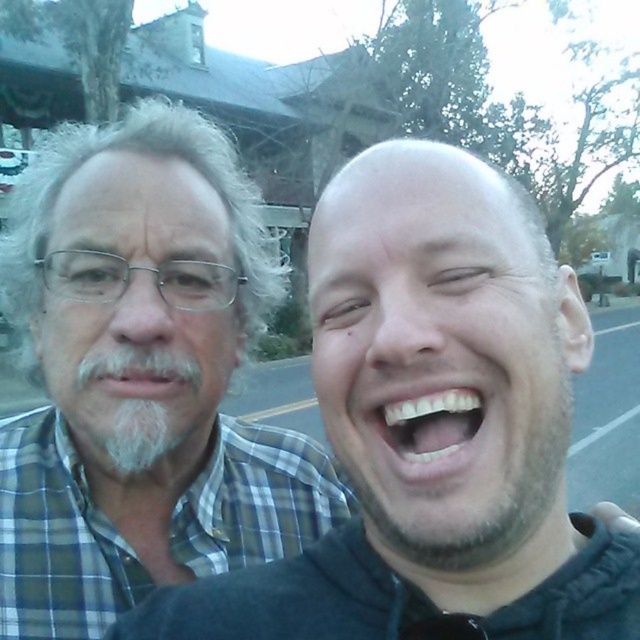
Question: Can you confirm if black matte jacket at center is positioned below gray plaid shirt at left?

Choices:
 (A) yes
 (B) no

Answer: (A)

Question: Is black matte jacket at center wider than gray plaid shirt at left?

Choices:
 (A) yes
 (B) no

Answer: (A)

Question: Which point is farther to the camera?

Choices:
 (A) gray plaid shirt at left
 (B) black matte jacket at center

Answer: (A)

Question: Is black matte jacket at center to the right of gray plaid shirt at left from the viewer's perspective?

Choices:
 (A) yes
 (B) no

Answer: (A)

Question: Which point is closer to the camera taking this photo?

Choices:
 (A) (33, 500)
 (B) (456, 477)

Answer: (B)